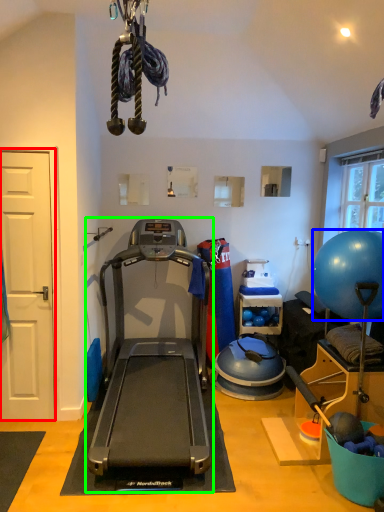
Question: Considering the real-world distances, which object is farthest from door (highlighted by a red box)? ball (highlighted by a blue box) or treadmill (highlighted by a green box)?

Choices:
 (A) ball
 (B) treadmill

Answer: (A)